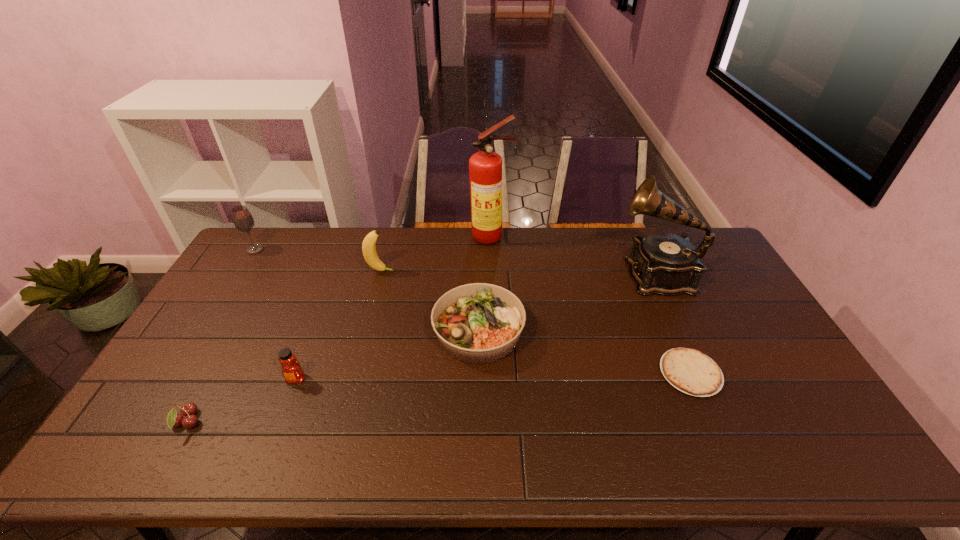
The height and width of the screenshot is (540, 960). In the image, there is a desktop. In order to click on blank space at the far edge in this screenshot , I will do `click(344, 230)`.

This screenshot has height=540, width=960. I want to click on vacant space at the near edge, so click(x=730, y=437).

The height and width of the screenshot is (540, 960). In the image, there is a desktop. In order to click on vacant area at the right edge in this screenshot , I will do `click(766, 415)`.

What are the coordinates of `free region at the far right corner of the desktop` in the screenshot? It's located at (689, 237).

At what (x,y) coordinates should I click in order to perform the action: click on free spot at the near right corner of the desktop. Please return your answer as a coordinate pair (x, y). The width and height of the screenshot is (960, 540). Looking at the image, I should click on click(x=839, y=438).

You are a GUI agent. You are given a task and a screenshot of the screen. Output one action in this format:
    pyautogui.click(x=<x>, y=<y>)
    Task: Click on the free spot between the seventh shortest object and the tallest object
    Image resolution: width=960 pixels, height=540 pixels.
    Given the screenshot: What is the action you would take?
    pyautogui.click(x=574, y=255)

I want to click on vacant space in between the salad plate and the seventh shortest object, so click(567, 303).

Where is `vacant area between the shortest object and the second object from left to right`? This screenshot has height=540, width=960. vacant area between the shortest object and the second object from left to right is located at coordinates (439, 397).

Where is `free point between the fifth tallest object and the salad plate`? free point between the fifth tallest object and the salad plate is located at coordinates (387, 355).

In order to click on empty location between the honey and the salad plate in this screenshot , I will do `click(387, 355)`.